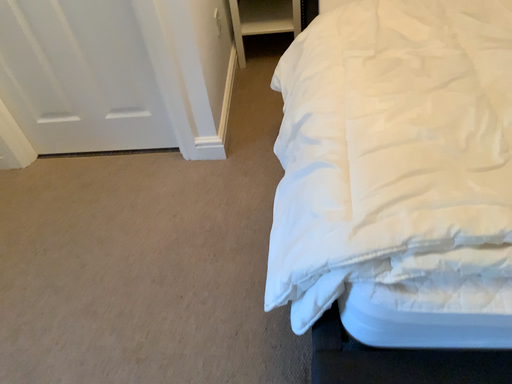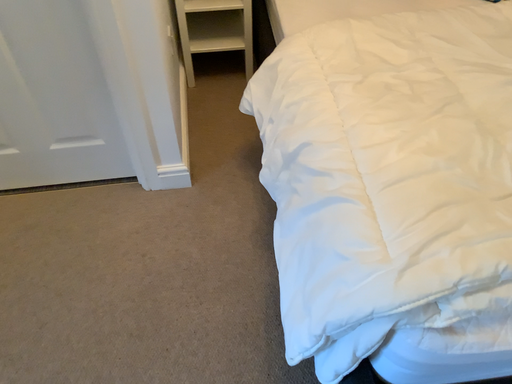
Question: How did the camera likely rotate when shooting the video?

Choices:
 (A) rotated right
 (B) rotated left

Answer: (A)